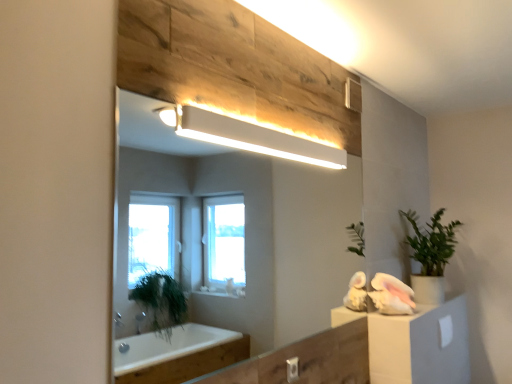
Question: Should I look upward or downward to see green matte plant at right?

Choices:
 (A) up
 (B) down

Answer: (B)

Question: Is white fluffy towel at right smaller than green matte plant at right?

Choices:
 (A) yes
 (B) no

Answer: (A)

Question: From a real-world perspective, is white fluffy towel at right located beneath green matte plant at right?

Choices:
 (A) yes
 (B) no

Answer: (A)

Question: Can you confirm if white fluffy towel at right is shorter than green matte plant at right?

Choices:
 (A) no
 (B) yes

Answer: (B)

Question: Is white fluffy towel at right to the right of green matte plant at right from the viewer's perspective?

Choices:
 (A) no
 (B) yes

Answer: (A)

Question: Is white fluffy towel at right wider than green matte plant at right?

Choices:
 (A) no
 (B) yes

Answer: (A)

Question: Is white fluffy towel at right placed right next to green matte plant at right?

Choices:
 (A) yes
 (B) no

Answer: (B)

Question: From a real-world perspective, is white matte rectangular light fixture at upper center on white fluffy towel at right?

Choices:
 (A) yes
 (B) no

Answer: (A)

Question: Is white matte rectangular light fixture at upper center positioned behind white fluffy towel at right?

Choices:
 (A) no
 (B) yes

Answer: (A)

Question: From the image's perspective, does white matte rectangular light fixture at upper center appear lower than white fluffy towel at right?

Choices:
 (A) no
 (B) yes

Answer: (A)

Question: Is white matte rectangular light fixture at upper center aimed at white fluffy towel at right?

Choices:
 (A) no
 (B) yes

Answer: (A)

Question: Is white matte rectangular light fixture at upper center touching white fluffy towel at right?

Choices:
 (A) yes
 (B) no

Answer: (B)

Question: Is white matte rectangular light fixture at upper center at the right side of white fluffy towel at right?

Choices:
 (A) no
 (B) yes

Answer: (A)

Question: Could you tell me if white fluffy towel at right is facing white glossy mirror at upper center?

Choices:
 (A) no
 (B) yes

Answer: (A)